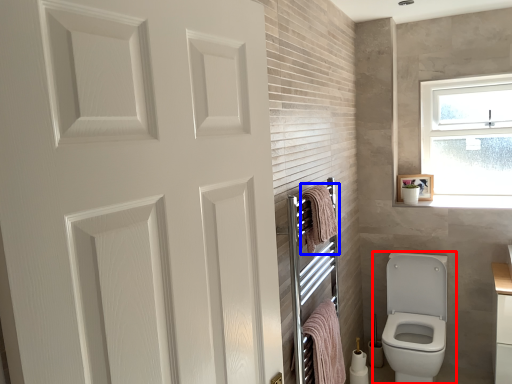
Question: Which object is closer to the camera taking this photo, toilet (highlighted by a red box) or bath towel (highlighted by a blue box)?

Choices:
 (A) toilet
 (B) bath towel

Answer: (B)